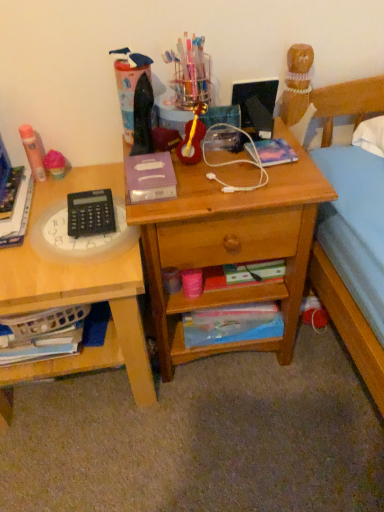
At what (x,y) coordinates should I click in order to perform the action: click on free space in front of matte orange glue stick at left, which is the 3th stationery from right to left. Please return your answer as a coordinate pair (x, y). The height and width of the screenshot is (512, 384). Looking at the image, I should click on (36, 198).